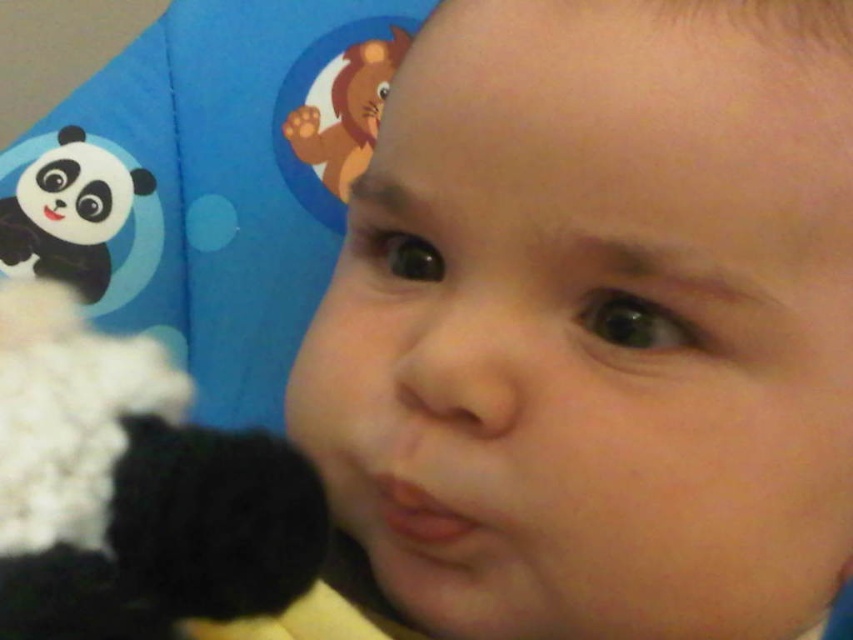
Question: Can you confirm if fuzzy black and white plush at left is wider than black plush panda at left?

Choices:
 (A) yes
 (B) no

Answer: (B)

Question: Which point appears closest to the camera in this image?

Choices:
 (A) (345, 36)
 (B) (74, 284)
 (C) (538, 388)
 (D) (3, 362)

Answer: (D)

Question: Does smooth skin baby at center have a larger size compared to fuzzy black and white plush at left?

Choices:
 (A) no
 (B) yes

Answer: (B)

Question: Which point is farther from the camera taking this photo?

Choices:
 (A) (289, 129)
 (B) (113, 627)
 (C) (45, 257)

Answer: (A)

Question: Which point is closer to the camera?

Choices:
 (A) (94, 250)
 (B) (315, 195)

Answer: (A)

Question: Can you confirm if fuzzy black and white plush at left is thinner than black plush panda at left?

Choices:
 (A) no
 (B) yes

Answer: (B)